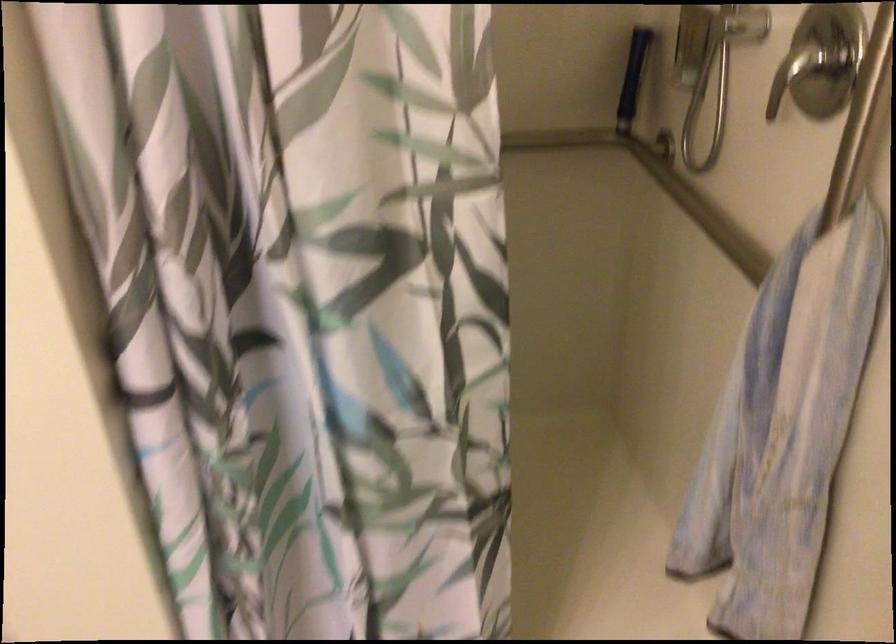
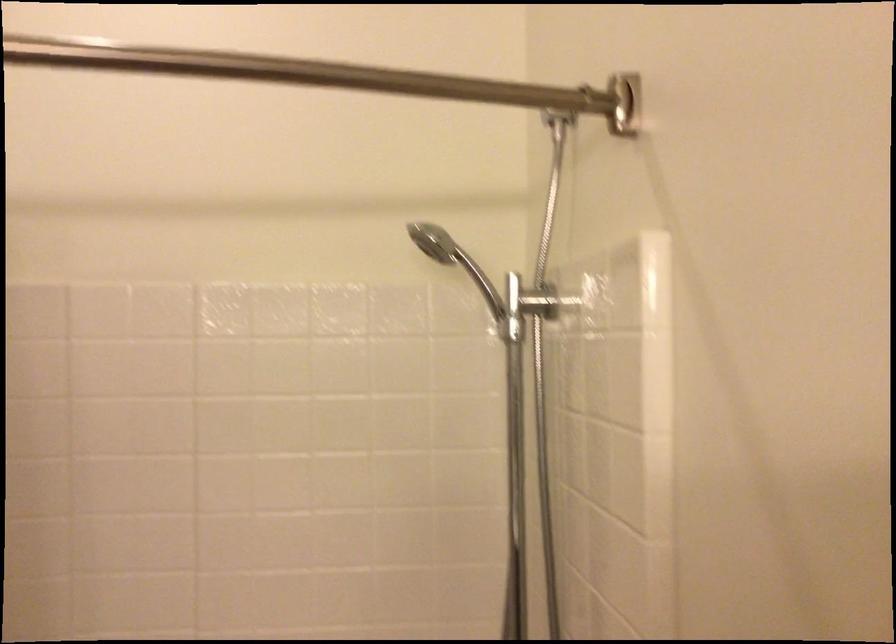
Question: Based on the continuous images, in which direction is the camera rotating? Reply with the corresponding letter.

Choices:
 (A) Left
 (B) Right
 (C) Up
 (D) Down

Answer: (C)